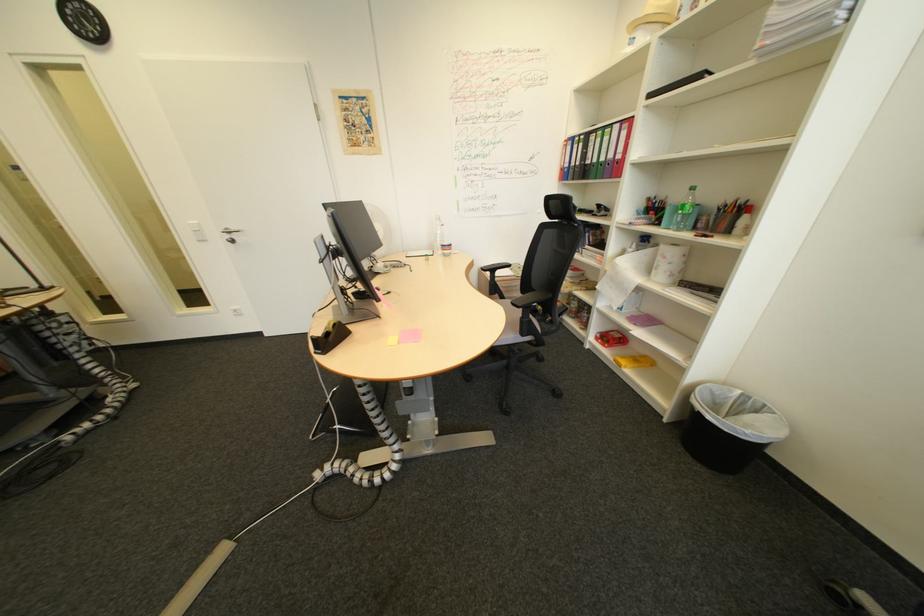
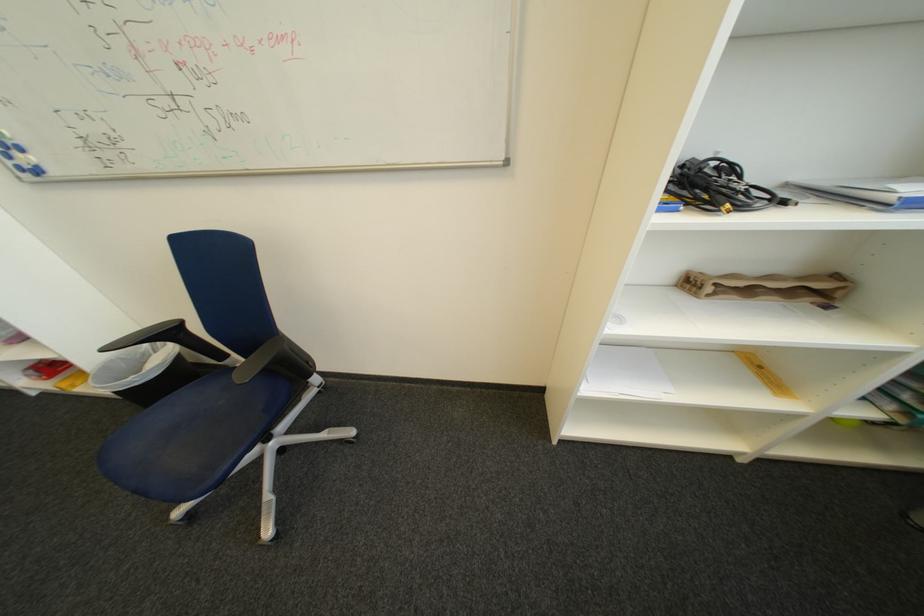
Where in the second image is the point corresponding to pixel 723 391 from the first image?

(134, 360)